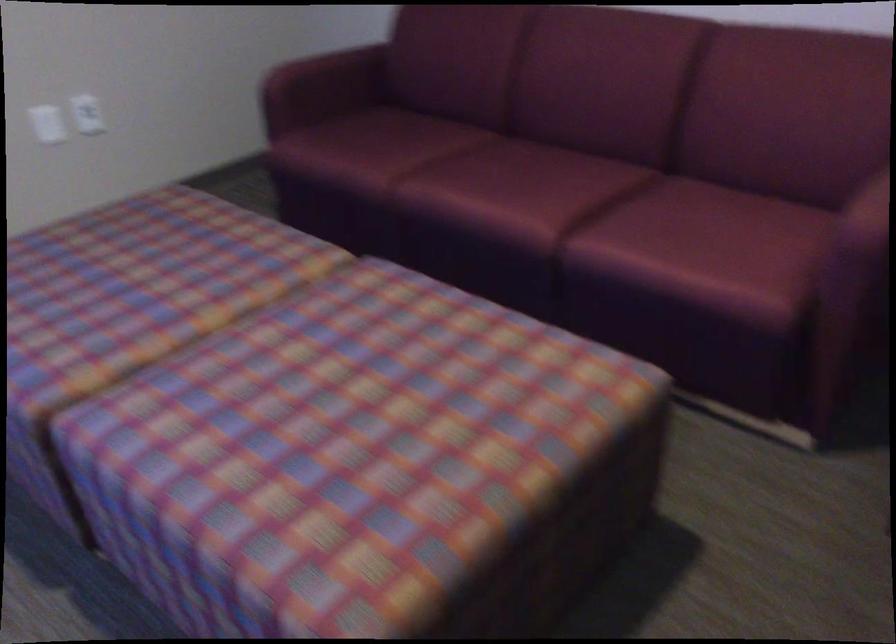
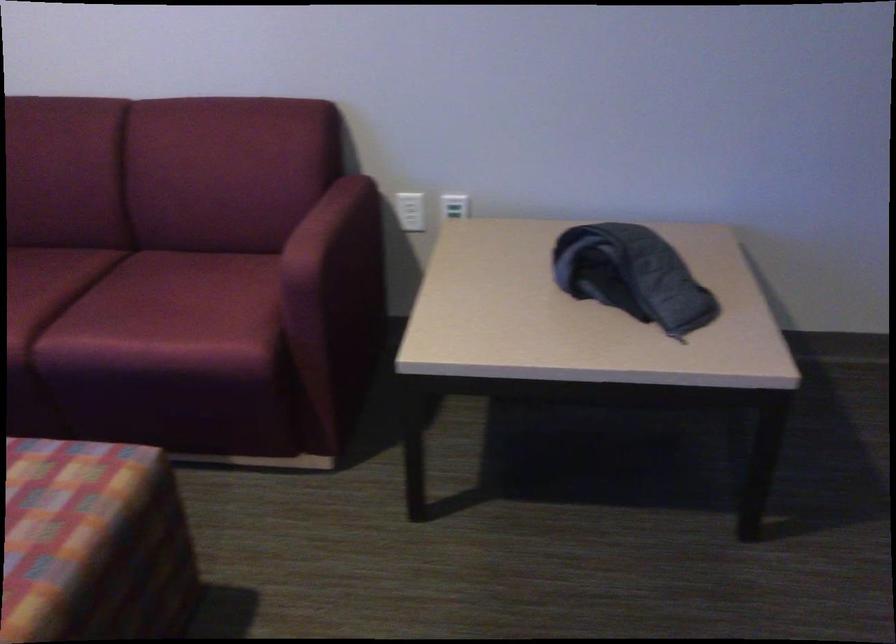
In the second image, find the point that corresponds to point 595,440 in the first image.

(93, 544)